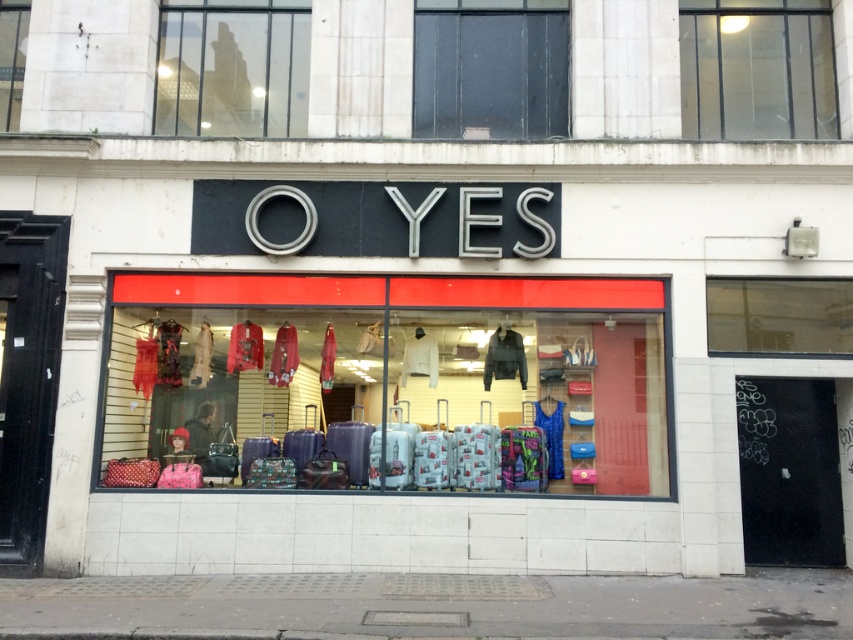
Describe the element at coordinates (756, 68) in the screenshot. I see `transparent glass at upper right` at that location.

How distant is transparent glass at upper right from transparent glass at upper left?

transparent glass at upper right is 17.67 feet away from transparent glass at upper left.

Who is more distant from viewer, (815,129) or (236,35)?

Positioned behind is point (236,35).

Where is `transparent glass at upper right`? Image resolution: width=853 pixels, height=640 pixels. transparent glass at upper right is located at coordinates (756, 68).

Consider the image. Can you confirm if matte plastic luggage at center is shorter than transparent glass at upper center?

Correct, matte plastic luggage at center is not as tall as transparent glass at upper center.

Between point (643, 433) and point (474, 93), which one is positioned behind?

The point (474, 93) is behind.

Is point (368, 333) positioned behind point (468, 22)?

That is False.

Locate an element on the screen. matte plastic luggage at center is located at coordinates (390, 381).

Between matte plastic luggage at center and transparent glass at upper right, which one appears on the right side from the viewer's perspective?

From the viewer's perspective, transparent glass at upper right appears more on the right side.

Between matte plastic luggage at center and transparent glass at upper right, which one appears on the left side from the viewer's perspective?

matte plastic luggage at center

Describe the element at coordinates (390, 381) in the screenshot. The image size is (853, 640). I see `matte plastic luggage at center` at that location.

Find the location of `matte plastic luggage at center`. matte plastic luggage at center is located at coordinates (390, 381).